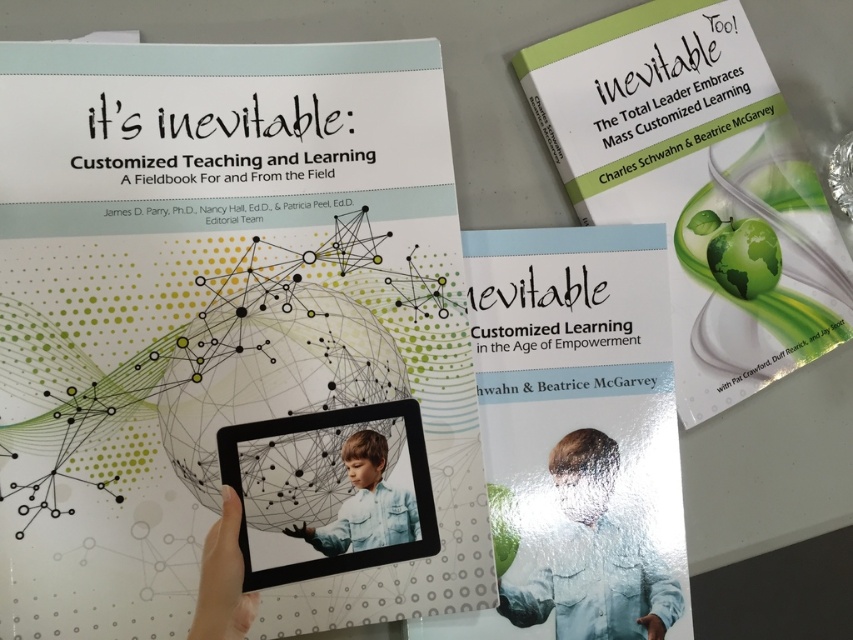
Who is shorter, green matte book at upper right or black matte tablet at center?

black matte tablet at center

Can you confirm if green matte book at upper right is smaller than black matte tablet at center?

Actually, green matte book at upper right might be larger than black matte tablet at center.

Who is more forward, (811, 305) or (267, 488)?

Point (267, 488)

Locate an element on the screen. green matte book at upper right is located at coordinates (699, 186).

Can you confirm if matte green book at center is shorter than skinny white finger at center?

In fact, matte green book at center may be taller than skinny white finger at center.

Who is shorter, matte green book at center or skinny white finger at center?

With less height is skinny white finger at center.

The image size is (853, 640). Describe the element at coordinates (578, 426) in the screenshot. I see `matte green book at center` at that location.

Locate an element on the screen. Image resolution: width=853 pixels, height=640 pixels. matte green book at center is located at coordinates (578, 426).

Does matte black tablet at center have a lesser height compared to black matte tablet at center?

Incorrect, matte black tablet at center's height does not fall short of black matte tablet at center's.

Between point (137, 500) and point (386, 458), which one is positioned behind?

Positioned behind is point (386, 458).

You are a GUI agent. You are given a task and a screenshot of the screen. Output one action in this format:
    pyautogui.click(x=<x>, y=<y>)
    Task: Click on the matte black tablet at center
    This screenshot has height=640, width=853.
    Given the screenshot: What is the action you would take?
    [218, 314]